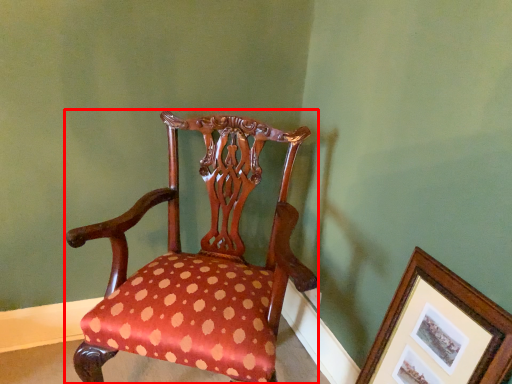
Question: From the image's perspective, considering the relative positions of chair (annotated by the red box) and picture frame in the image provided, where is chair (annotated by the red box) located with respect to the staircase?

Choices:
 (A) above
 (B) below

Answer: (A)